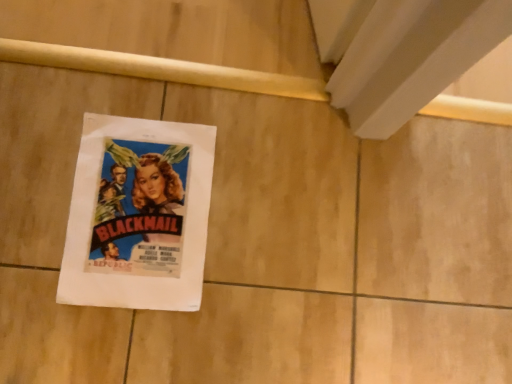
Find the location of `free space above matte paper poster at lower left (from a real-world perspective)`. free space above matte paper poster at lower left (from a real-world perspective) is located at coordinates [x=139, y=201].